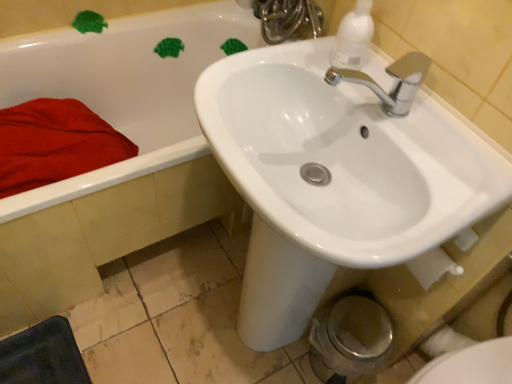
The width and height of the screenshot is (512, 384). I want to click on free space in front of white plastic soap dispenser at upper right, so click(x=386, y=117).